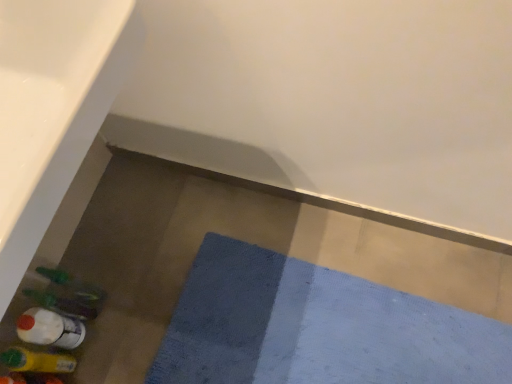
You are a GUI agent. You are given a task and a screenshot of the screen. Output one action in this format:
    pyautogui.click(x=<x>, y=<y>)
    Task: Click on the vacant region above blue textured bath mat at lower center (from a real-world perspective)
    
    Given the screenshot: What is the action you would take?
    pyautogui.click(x=312, y=329)